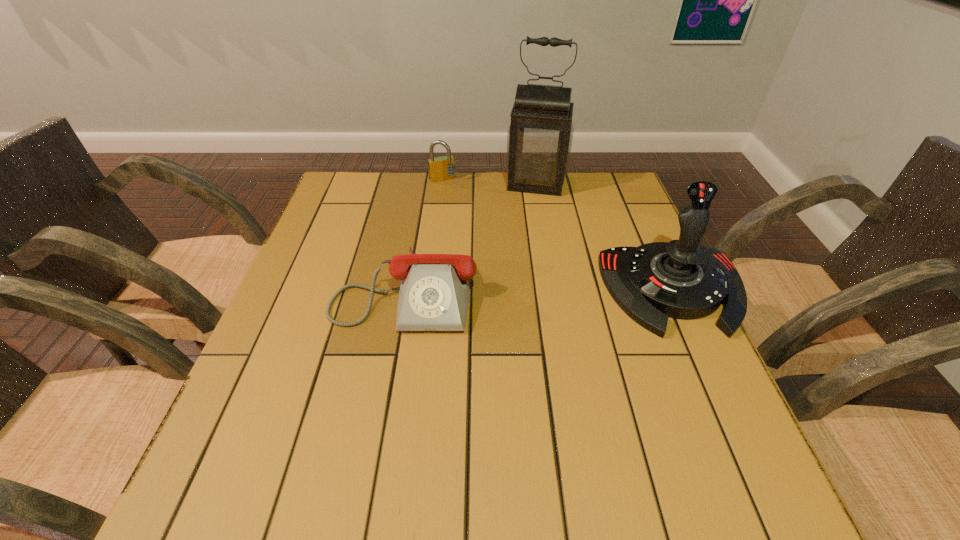
This screenshot has width=960, height=540. In the image, there is a desktop. In order to click on free space at the left edge in this screenshot , I will do `click(274, 357)`.

Locate an element on the screen. This screenshot has height=540, width=960. vacant space at the right edge of the desktop is located at coordinates (605, 220).

Identify the location of free space at the far left corner of the desktop. This screenshot has width=960, height=540. (339, 188).

I want to click on vacant area at the near left corner, so click(x=269, y=426).

Locate an element on the screen. The height and width of the screenshot is (540, 960). blank space at the far right corner of the desktop is located at coordinates (587, 179).

Identify the location of free space at the near right corner. The height and width of the screenshot is (540, 960). (667, 437).

Image resolution: width=960 pixels, height=540 pixels. I want to click on vacant space that is in between the rightmost object and the padlock, so click(x=558, y=235).

Where is `empty space that is in between the lantern and the rightmost object`? empty space that is in between the lantern and the rightmost object is located at coordinates (605, 237).

The image size is (960, 540). What are the coordinates of `free space between the third shortest object and the lantern` in the screenshot? It's located at (605, 237).

This screenshot has height=540, width=960. Identify the location of vacant area that lies between the rightmost object and the second shortest object. (558, 235).